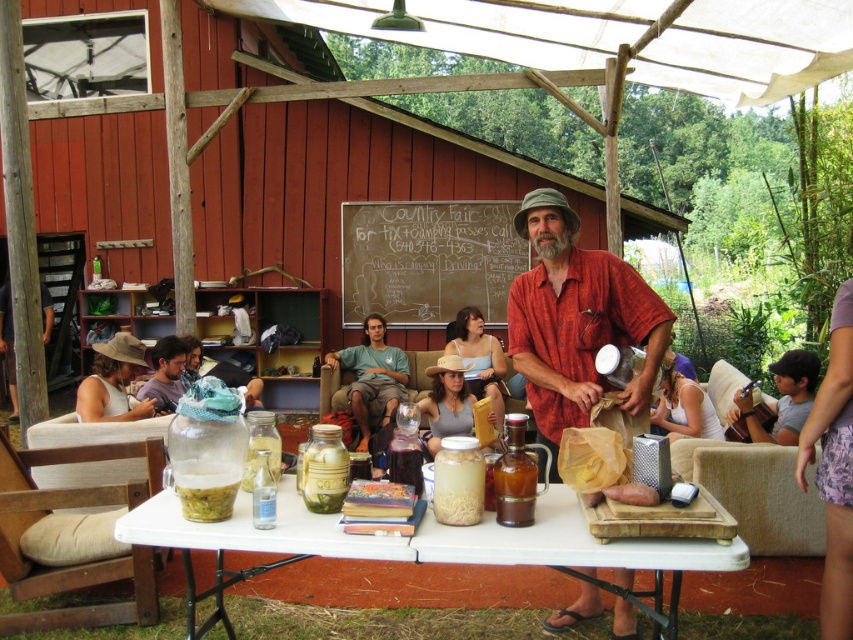
You are at the Country Fair and see two people wearing the green cotton shirt at center and the matte white tank top at lower left. Which person is positioned more to the left?

The matte white tank top at lower left is positioned more to the left compared to the green cotton shirt at center.

You are a visitor standing at the entrance of the event area. You want to read the chalkboard at center to see the camping pass details. Can you read the text clearly from where you are?

The chalkboard at center is 26.24 feet away from the viewer. At that distance, it may be difficult to read the text clearly without moving closer.

You are holding a camera and want to take a photo of the white plastic table at center. If you are standing 6.90 feet away from it, is that within the ideal focus range for most standard cameras?

Yes, the white plastic table at center and camera are 6.90 feet apart from each other, which is within the ideal focus range for most standard cameras.